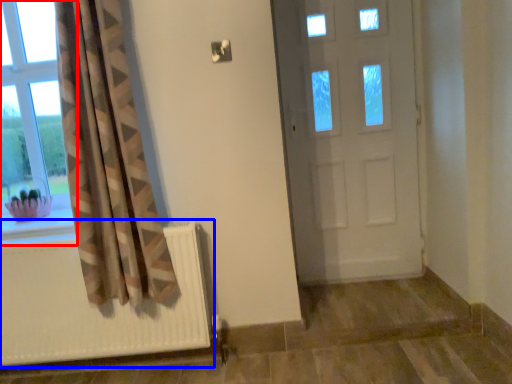
Question: Which object is closer to the camera taking this photo, window (highlighted by a red box) or radiator (highlighted by a blue box)?

Choices:
 (A) window
 (B) radiator

Answer: (B)